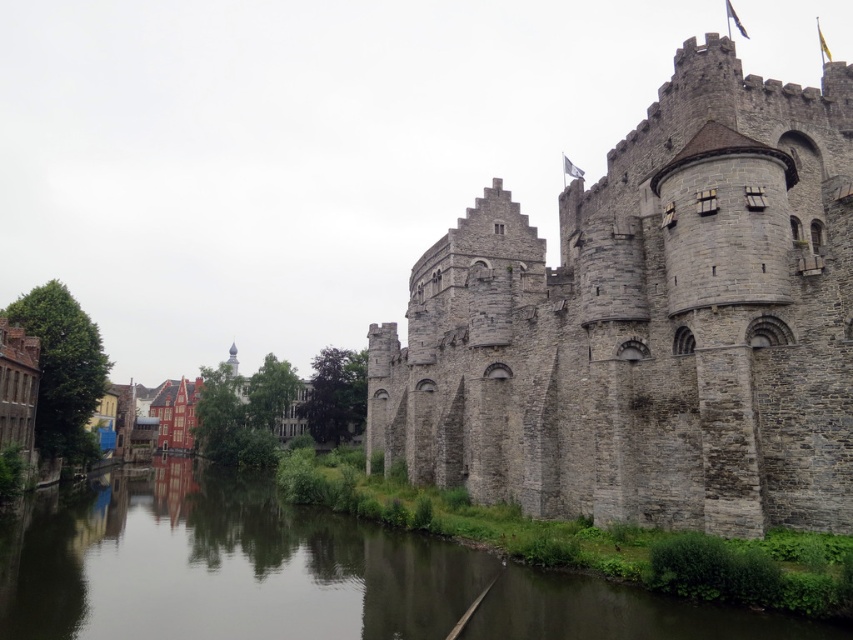
Which is more to the left, gray stone castle at center or smooth concrete water at center?

smooth concrete water at center

Is gray stone castle at center positioned before smooth concrete water at center?

No, gray stone castle at center is behind smooth concrete water at center.

Who is more distant from viewer, (474, 493) or (334, 572)?

The point (474, 493) is behind.

Find the location of a particular element. Image resolution: width=853 pixels, height=640 pixels. gray stone castle at center is located at coordinates (648, 323).